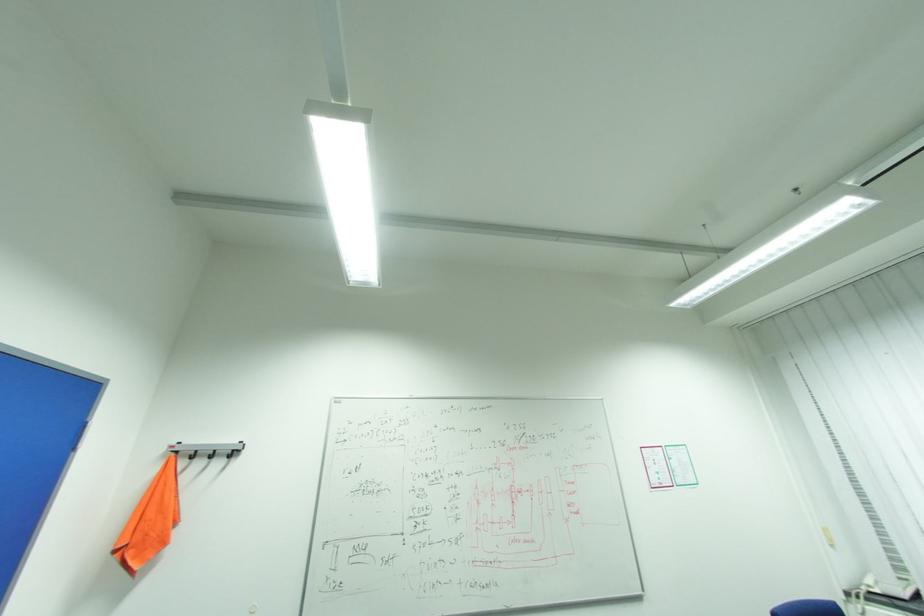
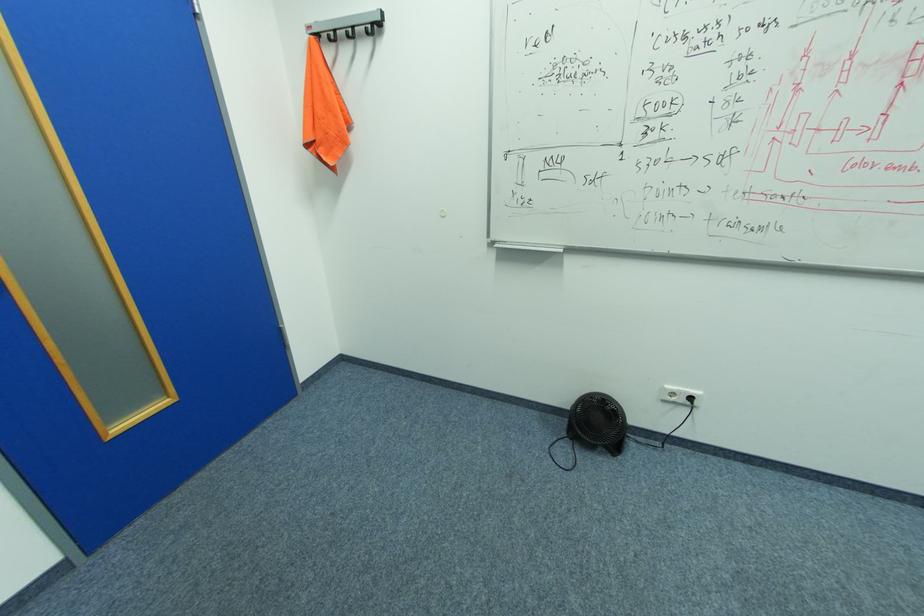
The point at (184, 452) is marked in the first image. Where is the corresponding point in the second image?

(324, 34)